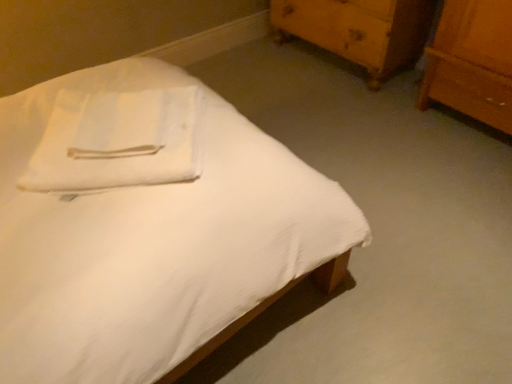
Question: Does white cotton towel at upper left lie in front of wooden chest of drawers at upper right?

Choices:
 (A) no
 (B) yes

Answer: (B)

Question: From a real-world perspective, does white cotton towel at upper left stand above wooden chest of drawers at upper right?

Choices:
 (A) yes
 (B) no

Answer: (A)

Question: Is white cotton towel at upper left turned away from wooden chest of drawers at upper right?

Choices:
 (A) yes
 (B) no

Answer: (B)

Question: Is white cotton towel at upper left positioned beyond the bounds of wooden chest of drawers at upper right?

Choices:
 (A) yes
 (B) no

Answer: (A)

Question: Considering the relative sizes of white cotton towel at upper left and wooden chest of drawers at upper right in the image provided, is white cotton towel at upper left thinner than wooden chest of drawers at upper right?

Choices:
 (A) no
 (B) yes

Answer: (B)

Question: Is the position of white cotton towel at upper left more distant than that of wooden chest of drawers at upper right?

Choices:
 (A) no
 (B) yes

Answer: (A)

Question: Does white cotton towel at upper left touch white matte bed at center?

Choices:
 (A) no
 (B) yes

Answer: (A)

Question: Can you confirm if white cotton towel at upper left is wider than white matte bed at center?

Choices:
 (A) yes
 (B) no

Answer: (B)

Question: Is white cotton towel at upper left turned away from white matte bed at center?

Choices:
 (A) no
 (B) yes

Answer: (B)

Question: From the image's perspective, is white cotton towel at upper left located beneath white matte bed at center?

Choices:
 (A) no
 (B) yes

Answer: (A)

Question: Can you confirm if white cotton towel at upper left is shorter than white matte bed at center?

Choices:
 (A) yes
 (B) no

Answer: (A)

Question: Can you confirm if white cotton towel at upper left is positioned to the left of white matte bed at center?

Choices:
 (A) yes
 (B) no

Answer: (A)

Question: Considering the relative sizes of white matte bed at center and white cotton towel at upper left in the image provided, is white matte bed at center shorter than white cotton towel at upper left?

Choices:
 (A) yes
 (B) no

Answer: (B)